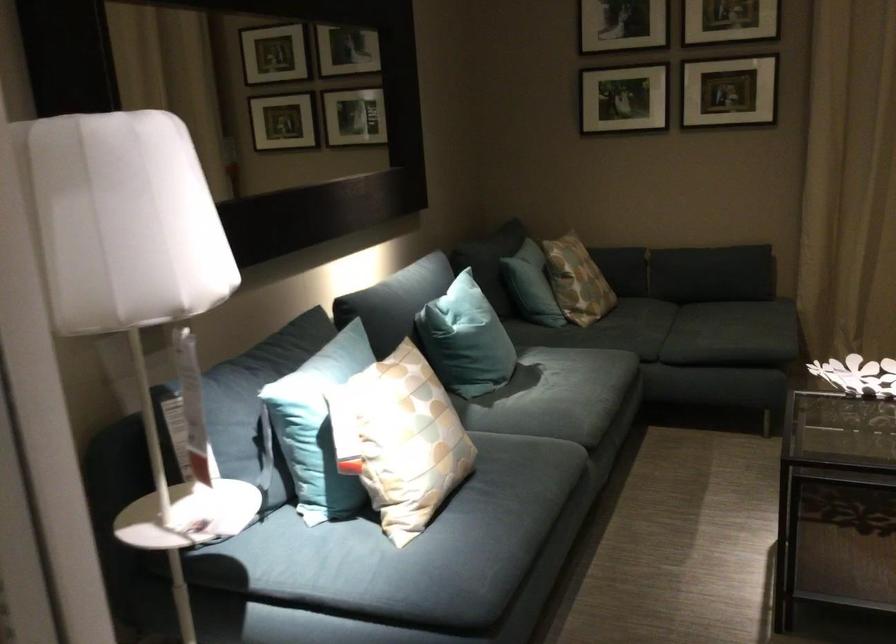
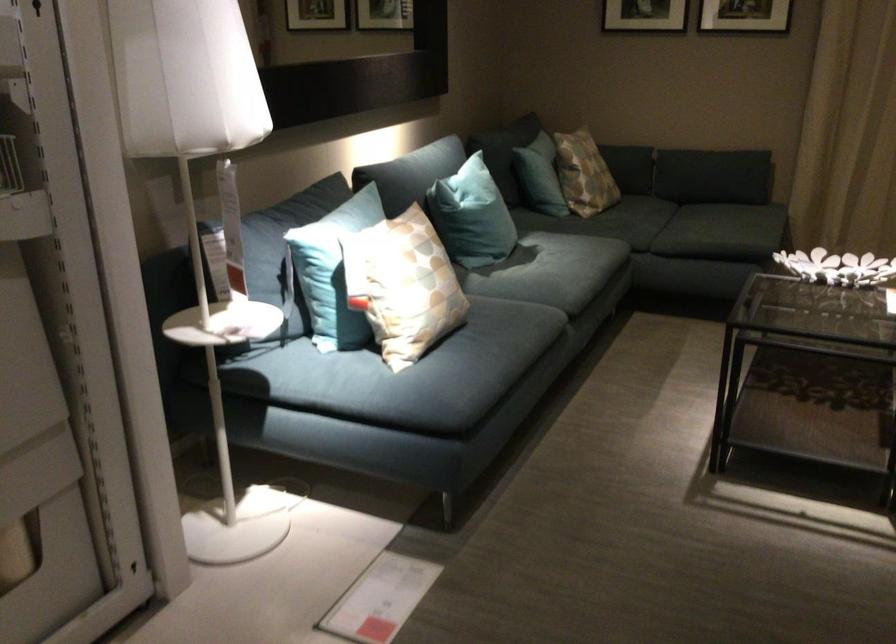
Find the pixel in the second image that matches the point at 561,404 in the first image.

(552, 275)